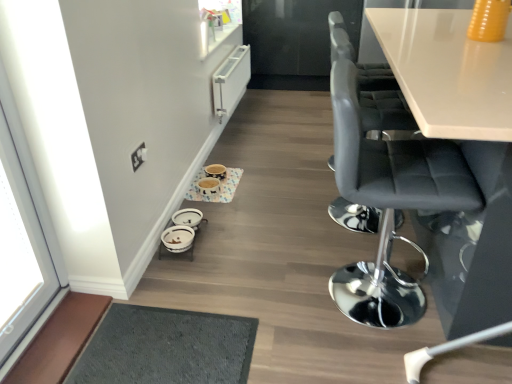
You are a GUI agent. You are given a task and a screenshot of the screen. Output one action in this format:
    pyautogui.click(x=<x>, y=<y>)
    Task: Click on the vacant area that is in front of matte ceramic bowls at center, positioned as the 1th round table in top-to-bottom order
    This screenshot has height=384, width=512.
    Given the screenshot: What is the action you would take?
    (240, 213)